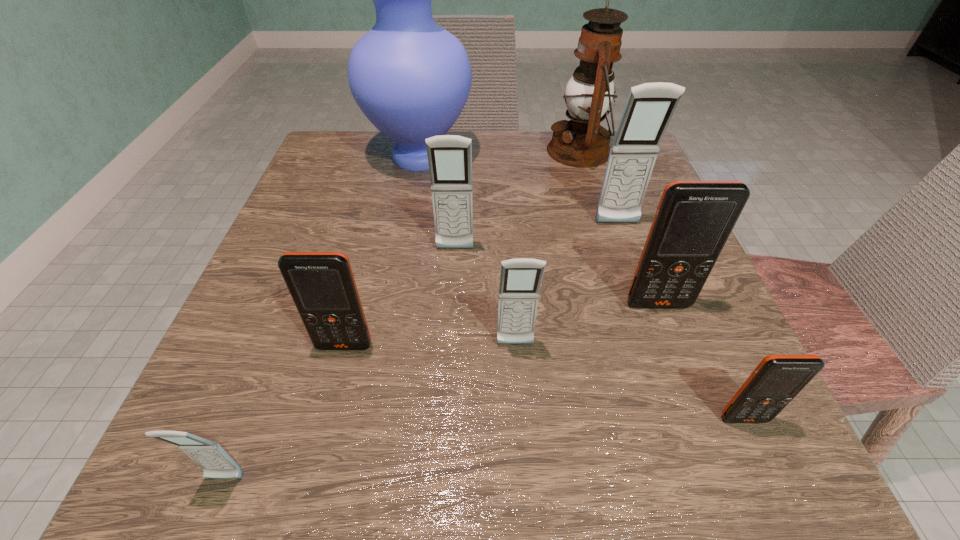
Locate an element on the screen. Image resolution: width=960 pixels, height=540 pixels. vacant position located 0.100m on the front-facing side of the farthest gray cellular telephone is located at coordinates (632, 268).

I want to click on vacant space situated 0.180m on the front-facing side of the third cellular telephone from left to right, so 449,340.

Locate an element on the screen. Image resolution: width=960 pixels, height=540 pixels. vacant region located on the screen of the third farthest cellular telephone is located at coordinates (713, 453).

Where is `free space located 0.060m on the front-facing side of the third gray cellular telephone from left to right`? The width and height of the screenshot is (960, 540). free space located 0.060m on the front-facing side of the third gray cellular telephone from left to right is located at coordinates (518, 389).

Identify the location of vacant space located 0.120m on the screen of the leftmost orange cellular telephone. This screenshot has height=540, width=960. (322, 434).

Find the location of a particular element. The width and height of the screenshot is (960, 540). free region located 0.070m on the screen of the second nearest cellular telephone is located at coordinates (773, 483).

Find the location of a particular element. This screenshot has width=960, height=540. lantern that is at the far edge is located at coordinates (582, 142).

Locate an element on the screen. Image resolution: width=960 pixels, height=540 pixels. vase located in the far edge section of the desktop is located at coordinates (411, 78).

Locate an element on the screen. This screenshot has width=960, height=540. vase located in the left edge section of the desktop is located at coordinates (411, 78).

Identify the location of lantern located at the right edge. The height and width of the screenshot is (540, 960). (582, 142).